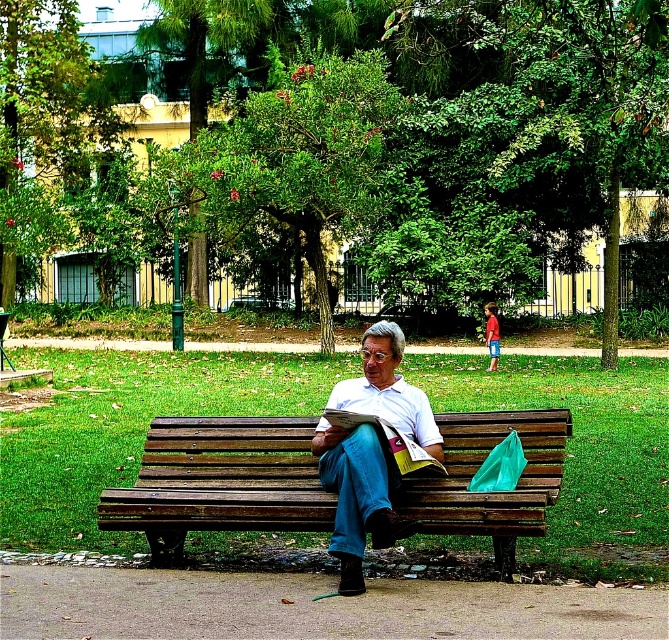
Which is below, wooden bench at center or white paper book at center?

wooden bench at center

Is point (215, 524) positioned after point (417, 468)?

Yes, point (215, 524) is farther from viewer.

Locate an element on the screen. wooden bench at center is located at coordinates (219, 481).

Is point (205, 460) closer to viewer compared to point (389, 413)?

That is False.

Can you confirm if wooden bench at center is positioned below matte white shirt at center?

Yes, wooden bench at center is below matte white shirt at center.

Find the location of a particular element. This screenshot has width=669, height=640. wooden bench at center is located at coordinates (219, 481).

Can you confirm if matte white shirt at center is positioned above white paper book at center?

No.

Which is more to the right, matte white shirt at center or white paper book at center?

Positioned to the right is white paper book at center.

Does point (324, 480) come in front of point (391, 445)?

No.

You are a GUI agent. You are given a task and a screenshot of the screen. Output one action in this format:
    pyautogui.click(x=<x>, y=<y>)
    Task: Click on the matte white shirt at center
    
    Given the screenshot: What is the action you would take?
    pyautogui.click(x=357, y=497)